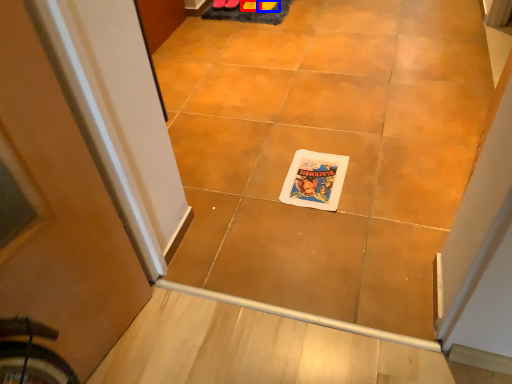
Question: Which of the following is the closest to the observer, footwear (highlighted by a red box) or footwear (highlighted by a blue box)?

Choices:
 (A) footwear
 (B) footwear

Answer: (B)